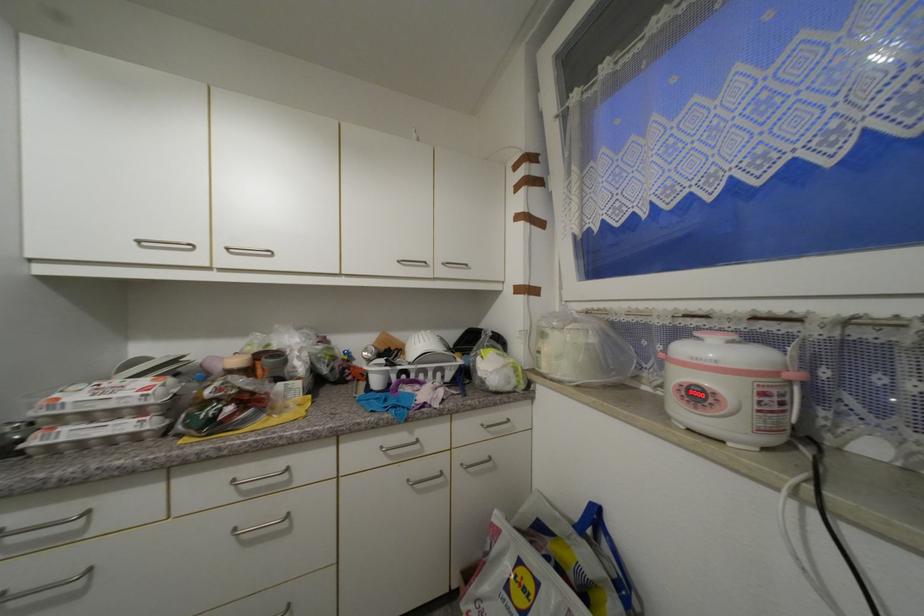
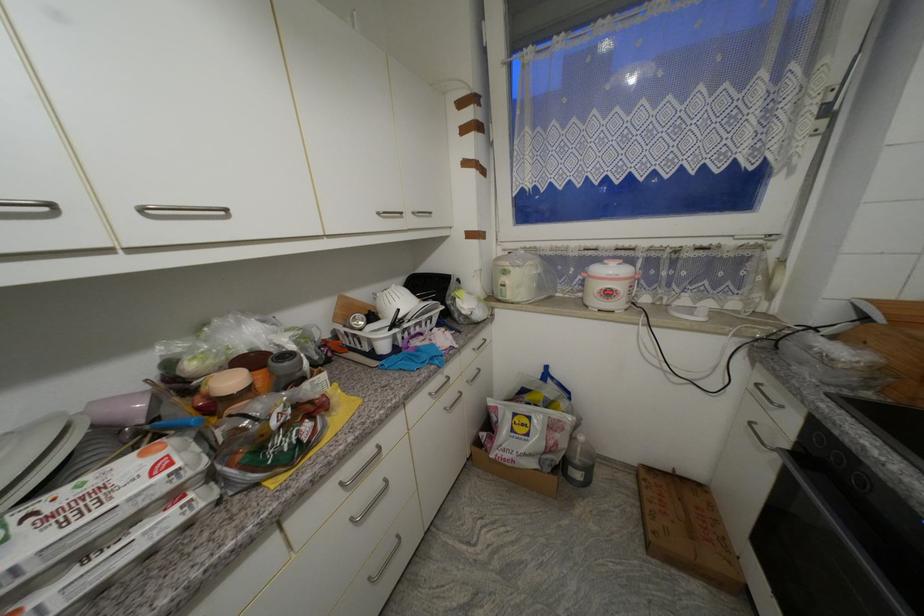
In the second image, find the point that corresponds to point (427, 379) in the first image.

(423, 331)